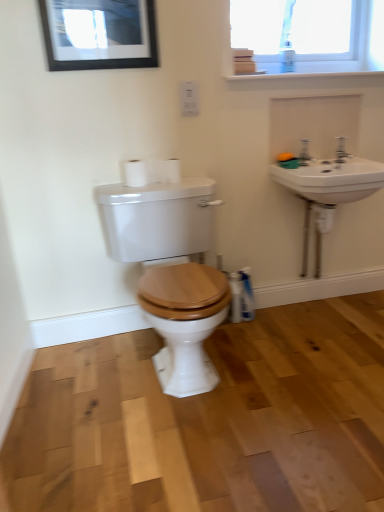
Locate an element on the screen. vacant area situated below white ceramic sink at upper right (from a real-world perspective) is located at coordinates (324, 312).